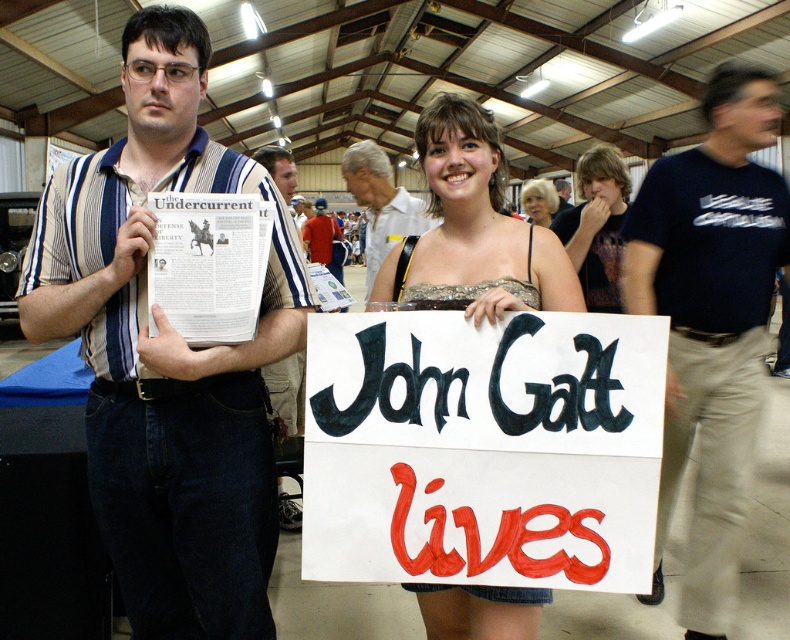
Is white paper sign at center smaller than striped fabric shirt at center?

Correct, white paper sign at center occupies less space than striped fabric shirt at center.

Is white paper sign at center shorter than striped fabric shirt at center?

Correct, white paper sign at center is not as tall as striped fabric shirt at center.

Between point (497, 538) and point (247, 492), which one is positioned in front?

Point (497, 538) is in front.

At what (x,y) coordinates should I click in order to perform the action: click on white paper sign at center. Please return your answer as a coordinate pair (x, y). This screenshot has width=790, height=640. Looking at the image, I should click on (482, 449).

Does white paper sign at center have a larger size compared to smooth blonde hair at center?

Incorrect, white paper sign at center is not larger than smooth blonde hair at center.

Can you confirm if white paper sign at center is wider than smooth blonde hair at center?

No, white paper sign at center is not wider than smooth blonde hair at center.

What are the coordinates of `white paper sign at center` in the screenshot? It's located at (482, 449).

Who is lower down, matte gold dress at center or white shirt at center?

matte gold dress at center is lower down.

Between matte gold dress at center and white shirt at center, which one appears on the right side from the viewer's perspective?

Positioned to the right is matte gold dress at center.

Identify the location of matte gold dress at center. (474, 228).